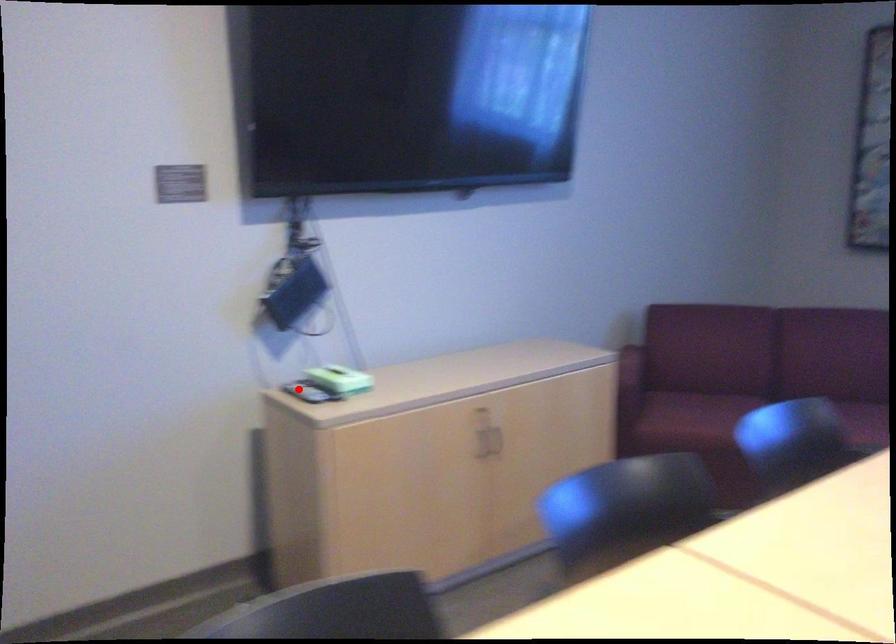
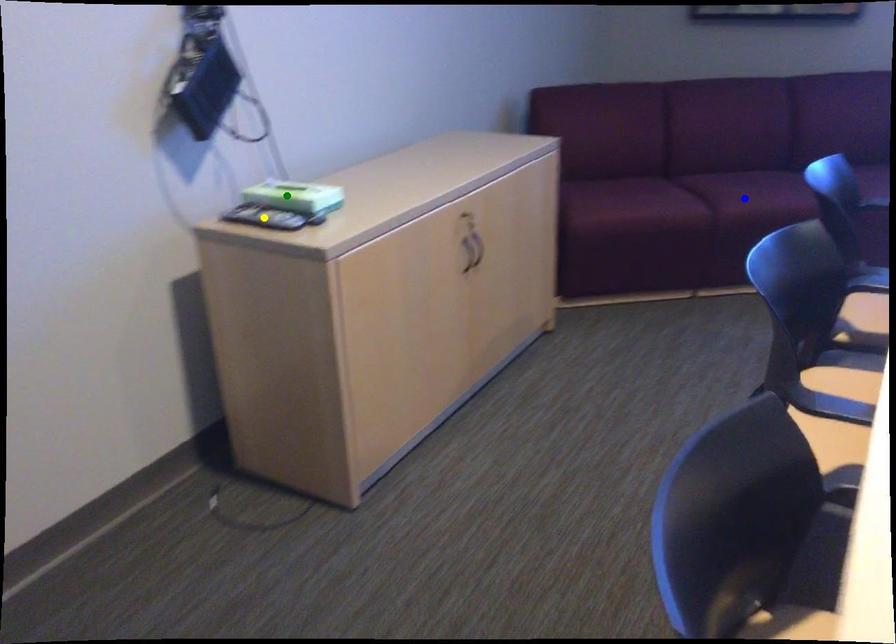
Question: I am providing you with two images of the same scene from different viewpoints. A red point is marked on the first image. You are given multiple points on the second image. Can you choose the point in image 2 that corresponds to the point in image 1?

Choices:
 (A) yellow point
 (B) blue point
 (C) green point

Answer: (A)